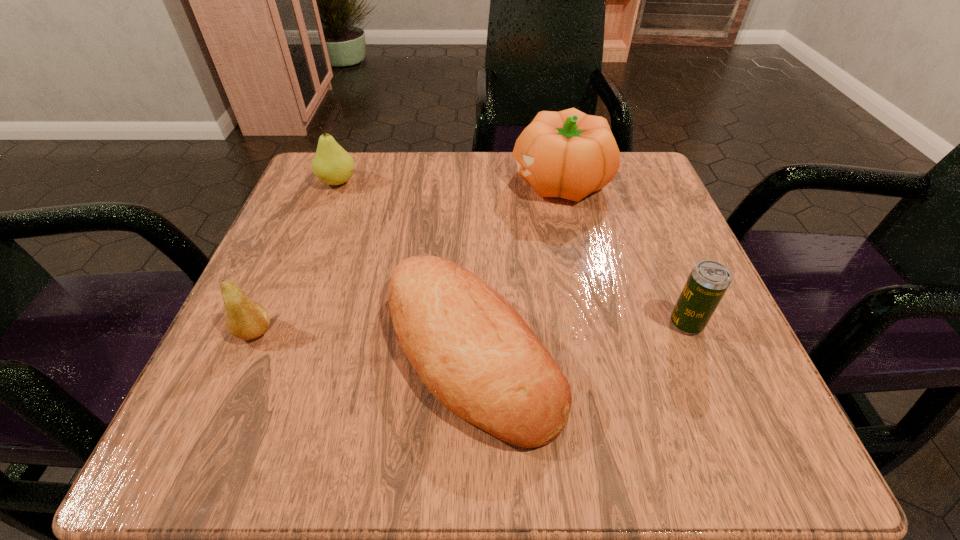
Image resolution: width=960 pixels, height=540 pixels. In the image, there is a desktop. Identify the location of vacant space at the near edge. (562, 463).

In the image, there is a desktop. Where is `vacant region at the left edge`? This screenshot has width=960, height=540. vacant region at the left edge is located at coordinates (315, 374).

This screenshot has width=960, height=540. Find the location of `vacant space at the right edge of the desktop`. vacant space at the right edge of the desktop is located at coordinates (711, 325).

Where is `vacant space at the far left corner of the desktop`? This screenshot has height=540, width=960. vacant space at the far left corner of the desktop is located at coordinates (372, 183).

The height and width of the screenshot is (540, 960). I want to click on vacant space at the near left corner of the desktop, so click(x=221, y=462).

Identify the location of free region at the far right corner of the desktop. The height and width of the screenshot is (540, 960). (641, 188).

Image resolution: width=960 pixels, height=540 pixels. What are the coordinates of `free spot between the tallest object and the beer can` in the screenshot? It's located at (623, 252).

Image resolution: width=960 pixels, height=540 pixels. What are the coordinates of `vacant space in between the farther pear and the rightmost object` in the screenshot? It's located at (512, 253).

The image size is (960, 540). I want to click on empty space that is in between the shorter pear and the pumpkin, so click(407, 256).

The width and height of the screenshot is (960, 540). In order to click on unoccupied position between the farther pear and the nearer pear in this screenshot , I will do `click(297, 257)`.